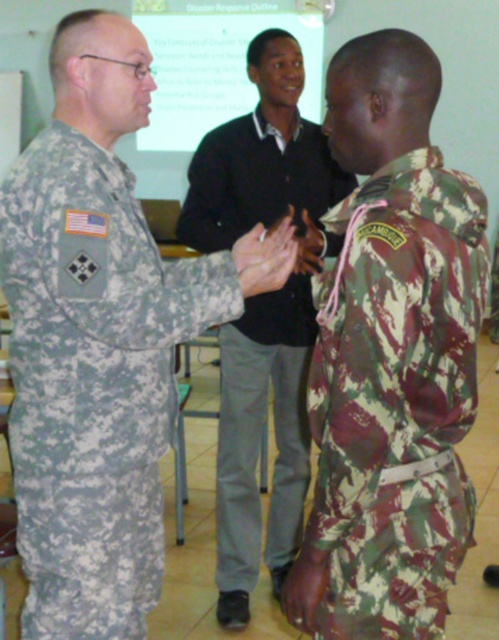
You are a photographer standing in the front row of the room. You want to take a photo of both the camouflage fabric uniform at right and the camo fabric uniform at center. Can you fit both in your camera frame if your camera has a 1.2 meter wide field of view?

The distance between the camouflage fabric uniform at right and the camo fabric uniform at center is 1.18 meters. Since the camera has a 1.2 meter wide field of view, both can be captured in the frame.